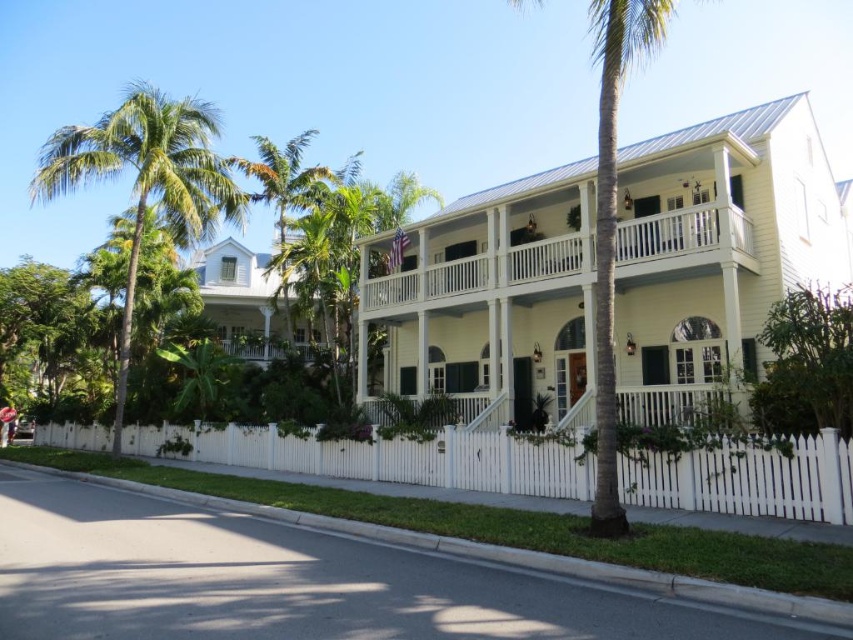
Question: Estimate the real-world distances between objects in this image. Which object is closer to the green leafy palm tree at upper left?

Choices:
 (A) green leafy palm tree at center
 (B) white picket fence at lower center

Answer: (B)

Question: Does white picket fence at lower center have a smaller size compared to green leafy palm tree at center?

Choices:
 (A) yes
 (B) no

Answer: (A)

Question: Which point is farther to the camera?

Choices:
 (A) (663, 13)
 (B) (252, 196)
 (C) (144, 164)

Answer: (B)

Question: Observing the image, what is the correct spatial positioning of white picket fence at lower center in reference to green leafy palm tree at left?

Choices:
 (A) right
 (B) left

Answer: (A)

Question: Is white picket fence at lower center positioned in front of green leafy palm tree at center?

Choices:
 (A) no
 (B) yes

Answer: (A)

Question: Based on their relative distances, which object is nearer to the green leafy palm tree at upper left?

Choices:
 (A) white picket fence at lower center
 (B) green leafy palm tree at left

Answer: (B)